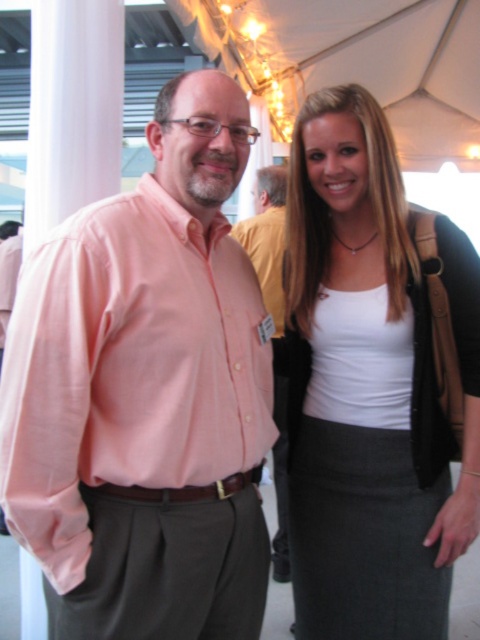
You are taking a photo of the scene and want to focus on the white matte tank top at center. Based on its position coordinates, is it closer to the top or bottom of the image?

The white matte tank top at center is located at point coordinates with a y value of 0.779, which places it closer to the bottom of the image since lower y values are at the top and higher y values are at the bottom.

You are organizing a clothing display and need to place the pink cotton shirt at center and the pink linen shirt at center. According to the image, which one is positioned higher?

The pink cotton shirt at center is located above the pink linen shirt at center, so it is positioned higher.